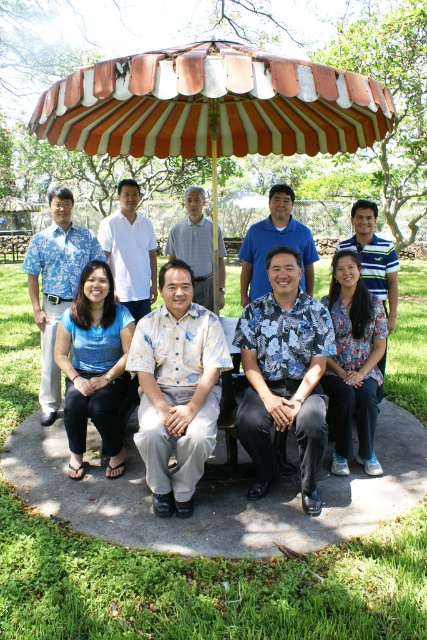
You are a photographer trying to capture a clear shot of the blue floral shirt at center without the striped fabric umbrella at center blocking it. What adjustment should you make to your camera position?

Since the striped fabric umbrella at center is closer to the viewer than the blue floral shirt at center, you should move your camera position backward to create more distance between the umbrella and the shirt, allowing the shirt to be visible without obstruction.

You are standing in a park and see the striped fabric umbrella at center and the blue floral shirt at center. Which object is positioned higher from the ground?

The striped fabric umbrella at center is located above the blue floral shirt at center, so it is higher from the ground.